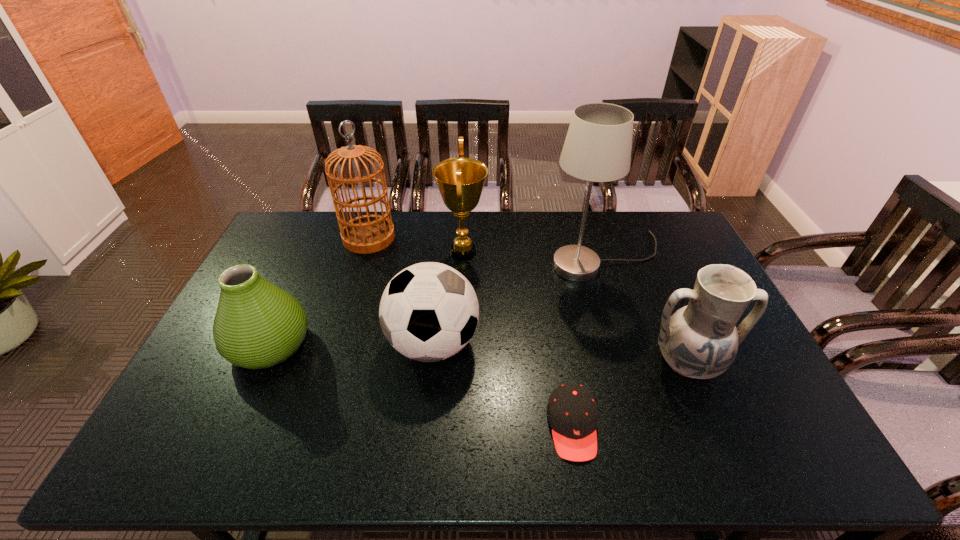
Find the location of a particular element. This screenshot has height=540, width=960. blank space that satisfies the following two spatial constraints: 1. on the main logo of the soccer ball; 2. on the front side of the vase is located at coordinates (433, 345).